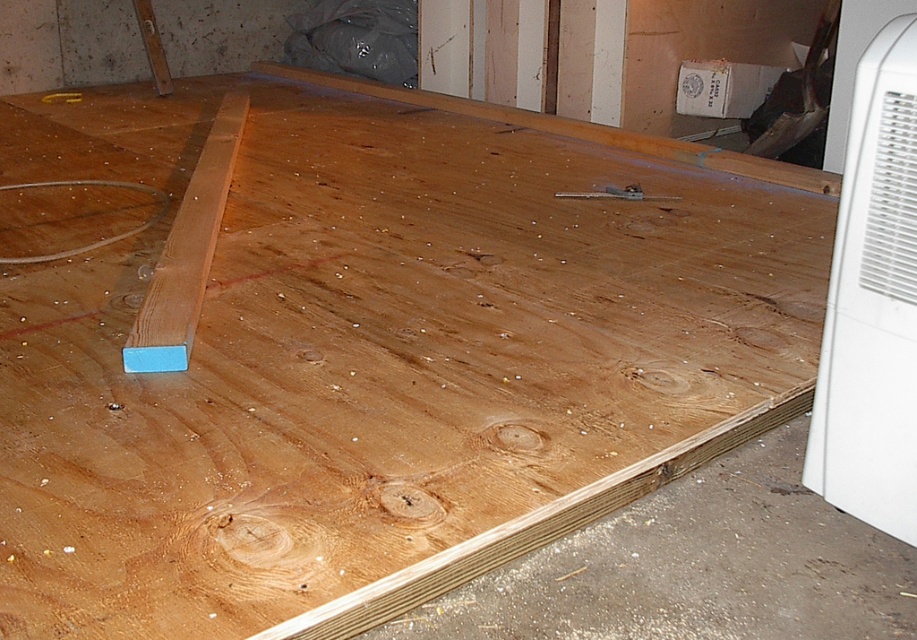
Can you confirm if metallic silver tool at center is bigger than blue plastic square at lower left?

Incorrect, metallic silver tool at center is not larger than blue plastic square at lower left.

Does metallic silver tool at center appear on the left side of blue plastic square at lower left?

In fact, metallic silver tool at center is to the right of blue plastic square at lower left.

Is point (558, 195) positioned before point (58, 99)?

That is True.

The height and width of the screenshot is (640, 917). Find the location of `metallic silver tool at center`. metallic silver tool at center is located at coordinates (615, 195).

Based on the photo, can you confirm if white plastic air conditioner at right is positioned to the right of light brown wood plank at lower left?

Correct, you'll find white plastic air conditioner at right to the right of light brown wood plank at lower left.

Describe the element at coordinates (871, 301) in the screenshot. This screenshot has height=640, width=917. I see `white plastic air conditioner at right` at that location.

In order to click on white plastic air conditioner at right in this screenshot , I will do `click(871, 301)`.

Is light brown wood plank at lower left positioned in front of blue plastic square at lower left?

Yes.

Which is below, light brown wood plank at lower left or blue plastic square at lower left?

light brown wood plank at lower left is lower down.

The width and height of the screenshot is (917, 640). What do you see at coordinates (186, 252) in the screenshot?
I see `light brown wood plank at lower left` at bounding box center [186, 252].

The height and width of the screenshot is (640, 917). What are the coordinates of `light brown wood plank at lower left` in the screenshot? It's located at (186, 252).